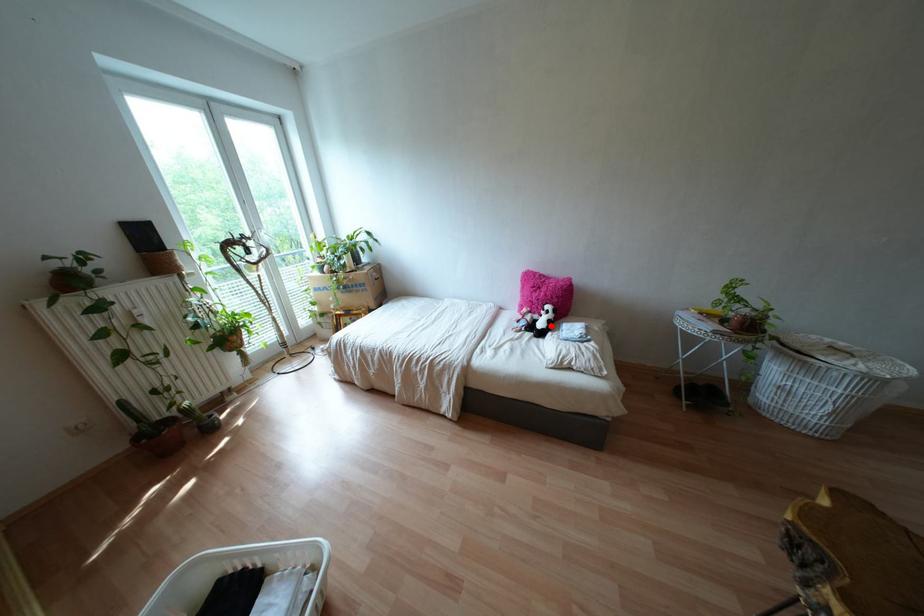
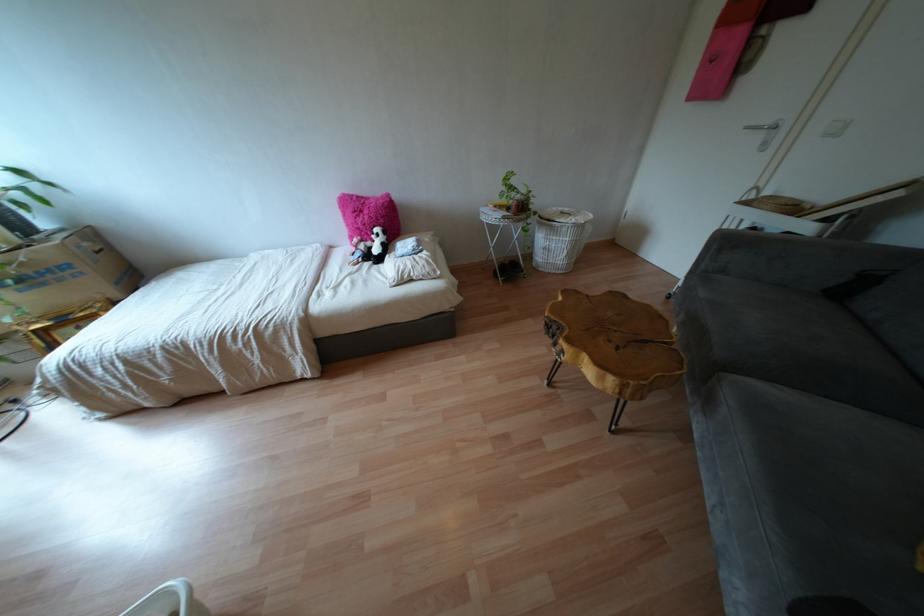
Question: I am providing you with two images of the same scene from different viewpoints. Given a red point in image1, look at the same physical point in image2. Is it:

Choices:
 (A) Closer to the viewpoint
 (B) Farther from the viewpoint

Answer: (B)